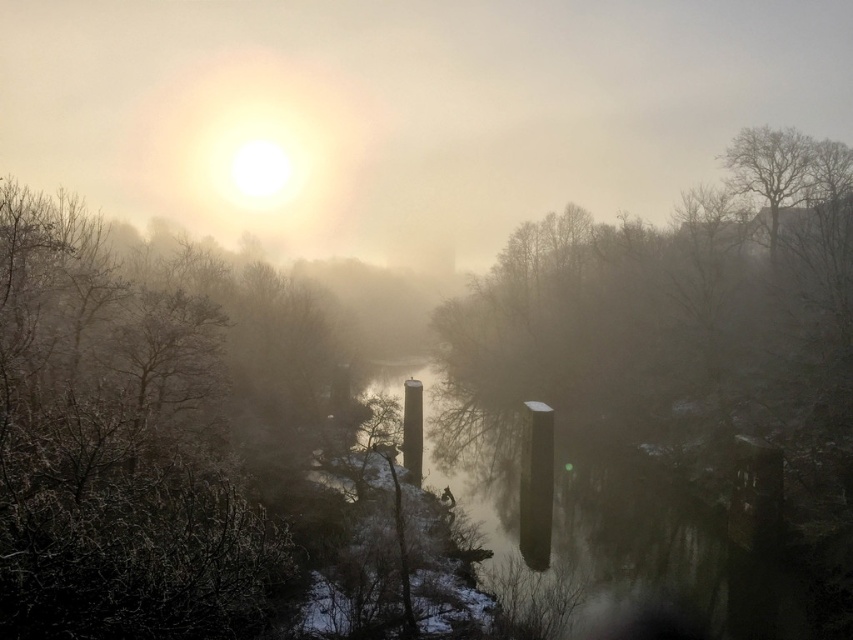
Is point (750, 150) positioned behind point (614, 577)?

Yes.

Which is more to the left, smooth bark tree at center or smooth concrete pillars at center?

smooth concrete pillars at center

Which is in front, point (848, 385) or point (679, 552)?

Point (679, 552) is more forward.

You are a GUI agent. You are given a task and a screenshot of the screen. Output one action in this format:
    pyautogui.click(x=<x>, y=<y>)
    Task: Click on the smooth bark tree at center
    The height and width of the screenshot is (640, 853).
    Given the screenshot: What is the action you would take?
    pyautogui.click(x=666, y=310)

Is point (22, 593) closer to viewer compared to point (763, 358)?

Yes, point (22, 593) is closer to viewer.

Which is more to the left, frosted brown tree at upper left or smooth bark tree at center?

frosted brown tree at upper left

Find the location of a particular element. The width and height of the screenshot is (853, 640). frosted brown tree at upper left is located at coordinates (119, 451).

I want to click on frosted brown tree at upper left, so click(x=119, y=451).

Can you confirm if frosted brown tree at upper left is thinner than smooth concrete pillars at center?

Yes.

Does frosted brown tree at upper left have a greater width compared to smooth concrete pillars at center?

No, frosted brown tree at upper left is not wider than smooth concrete pillars at center.

Is point (117, 278) positioned after point (682, 600)?

Yes, it is.

At what (x,y) coordinates should I click in order to perform the action: click on frosted brown tree at upper left. Please return your answer as a coordinate pair (x, y). Image resolution: width=853 pixels, height=640 pixels. Looking at the image, I should click on (119, 451).